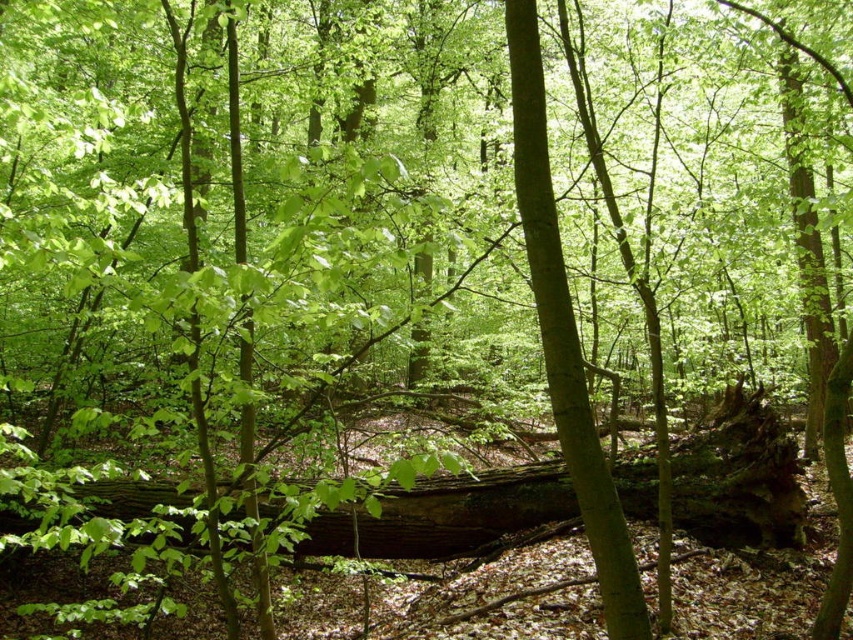
Question: Which point appears closest to the camera in this image?

Choices:
 (A) (517, 483)
 (B) (599, 545)

Answer: (B)

Question: Is rough bark log at center to the left of green matte tree trunk at center from the viewer's perspective?

Choices:
 (A) no
 (B) yes

Answer: (A)

Question: Among these points, which one is farthest from the camera?

Choices:
 (A) click(758, 525)
 (B) click(593, 529)

Answer: (A)

Question: Can you confirm if rough bark log at center is smaller than green matte tree trunk at center?

Choices:
 (A) yes
 (B) no

Answer: (B)

Question: Does rough bark log at center appear over green matte tree trunk at center?

Choices:
 (A) no
 (B) yes

Answer: (A)